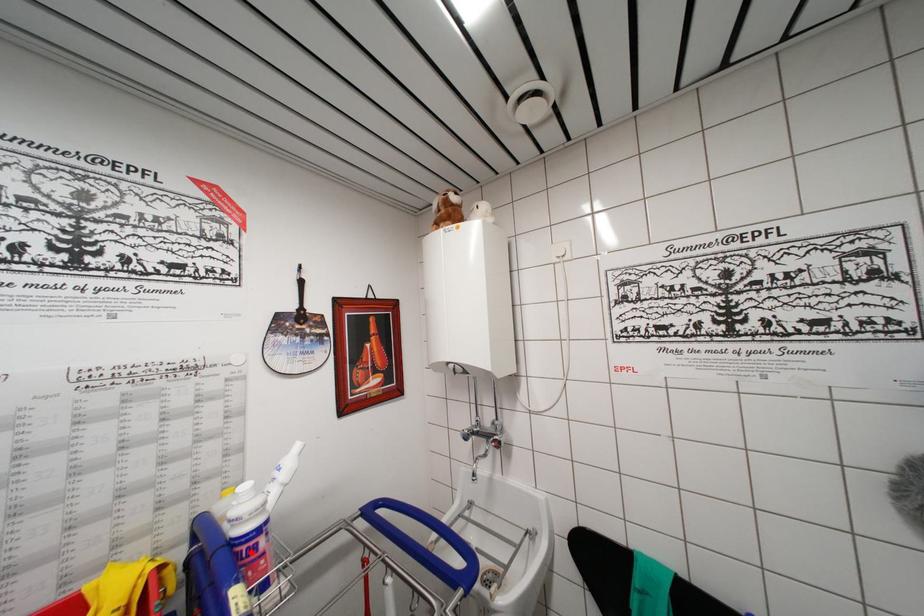
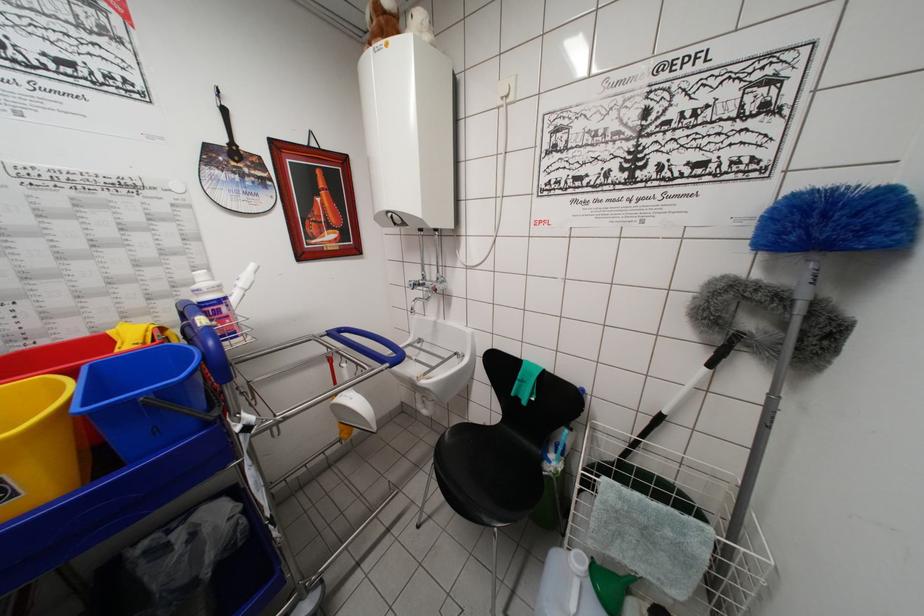
Question: I am providing you with two images of the same scene from different viewpoints. A red point is marked on the first image. Is the red point's position out of view in image 2?

Choices:
 (A) Yes
 (B) No

Answer: (B)